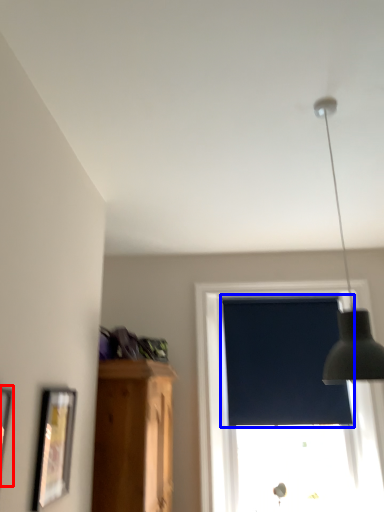
Question: Which object appears closest to the camera in this image, picture frame (highlighted by a red box) or window screen (highlighted by a blue box)?

Choices:
 (A) picture frame
 (B) window screen

Answer: (A)